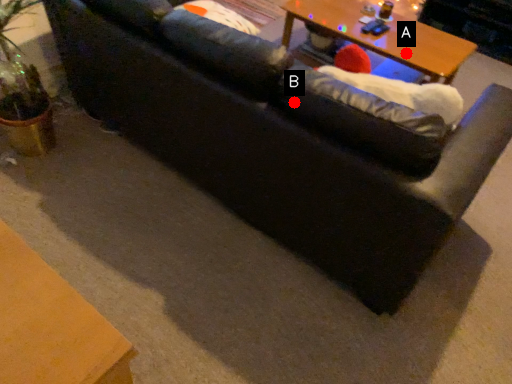
Question: Two points are circled on the image, labeled by A and B beside each circle. Which of the following is the closest to the observer?

Choices:
 (A) A is closer
 (B) B is closer

Answer: (B)